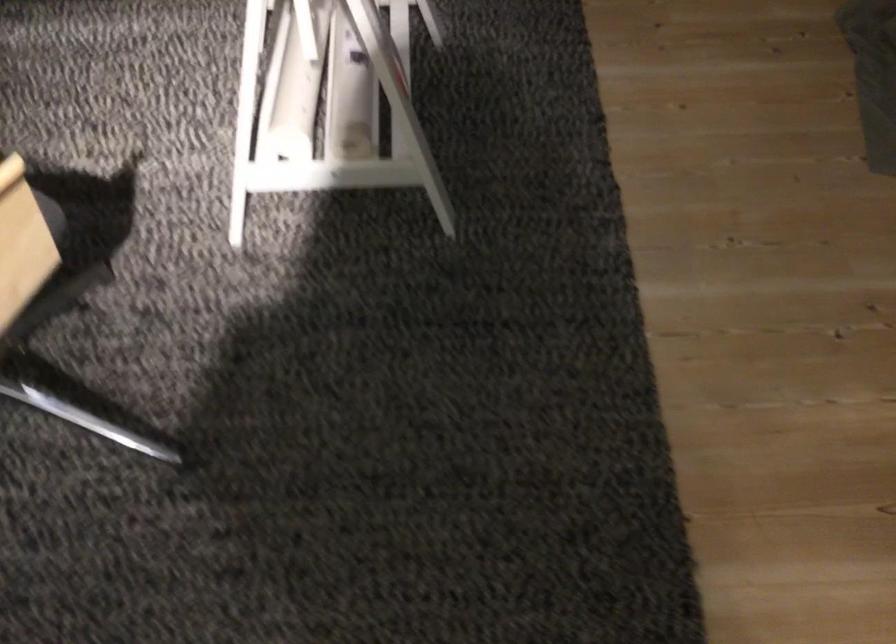
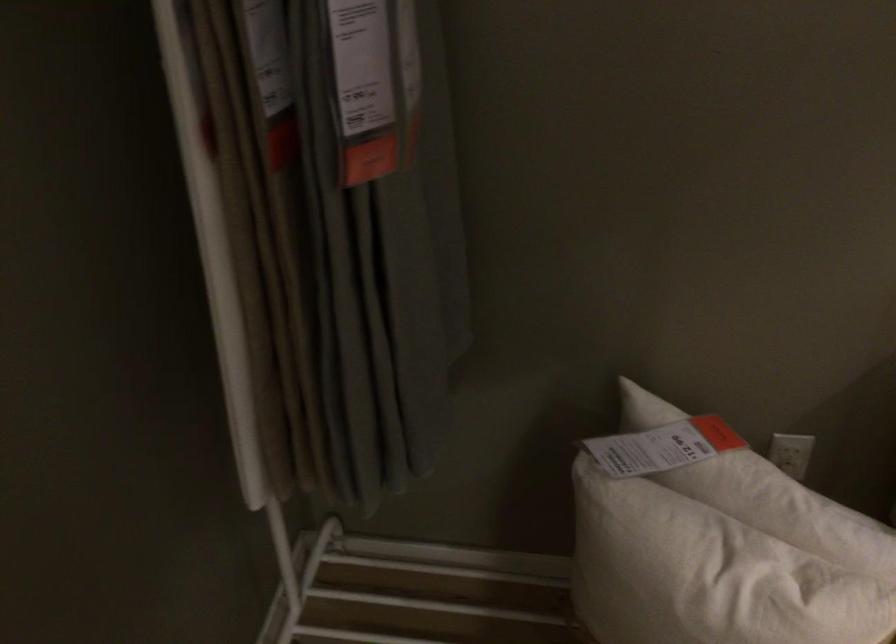
The images are taken continuously from a first-person perspective. In which direction are you moving?

The movement direction of the cameraman is left, forward.